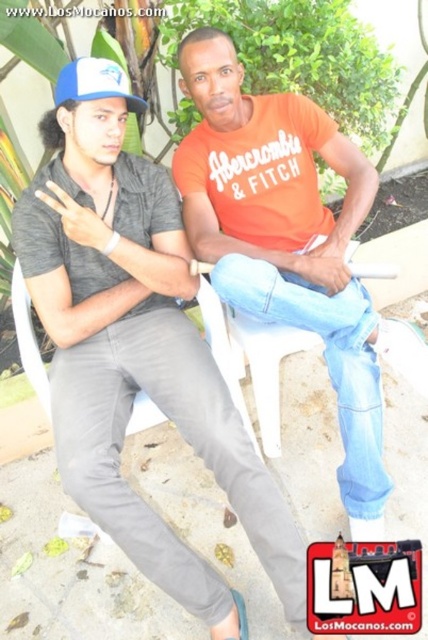
Is gray cotton shirt at left taller than blue fabric baseball cap at upper left?

Yes, gray cotton shirt at left is taller than blue fabric baseball cap at upper left.

Can you confirm if gray cotton shirt at left is bigger than blue fabric baseball cap at upper left?

Yes, gray cotton shirt at left is bigger than blue fabric baseball cap at upper left.

What do you see at coordinates (137, 356) in the screenshot? I see `gray cotton shirt at left` at bounding box center [137, 356].

The height and width of the screenshot is (640, 428). I want to click on gray cotton shirt at left, so point(137,356).

Does gray cotton shirt at left have a lesser height compared to orange cotton t-shirt at center?

Indeed, gray cotton shirt at left has a lesser height compared to orange cotton t-shirt at center.

Which is above, gray cotton shirt at left or orange cotton t-shirt at center?

Positioned higher is orange cotton t-shirt at center.

You are a GUI agent. You are given a task and a screenshot of the screen. Output one action in this format:
    pyautogui.click(x=<x>, y=<y>)
    Task: Click on the gray cotton shirt at left
    The image size is (428, 640).
    Given the screenshot: What is the action you would take?
    pyautogui.click(x=137, y=356)

Is orange cotton t-shirt at center wider than blue fabric baseball cap at upper left?

Correct, the width of orange cotton t-shirt at center exceeds that of blue fabric baseball cap at upper left.

The width and height of the screenshot is (428, 640). Describe the element at coordinates (285, 241) in the screenshot. I see `orange cotton t-shirt at center` at that location.

I want to click on orange cotton t-shirt at center, so click(x=285, y=241).